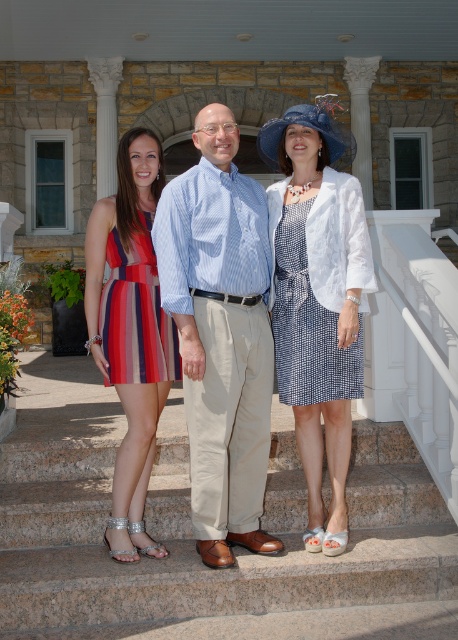
Looking at this image, which of these two, matte blue dress at center or striped fabric dress at center, stands taller?

With more height is matte blue dress at center.

Consider the image. Measure the distance from matte blue dress at center to striped fabric dress at center.

matte blue dress at center and striped fabric dress at center are 6.97 inches apart from each other.

Which is behind, point (190, 326) or point (114, 545)?

The point (114, 545) is more distant.

Image resolution: width=458 pixels, height=640 pixels. In order to click on matte blue dress at center in this screenshot , I will do `click(221, 332)`.

Which is below, blue striped shirt at center or blue textured dress at center?

blue striped shirt at center is lower down.

Is blue striped shirt at center to the left of blue textured dress at center from the viewer's perspective?

Correct, you'll find blue striped shirt at center to the left of blue textured dress at center.

Is point (257, 278) positioned behind point (349, 413)?

No, it is not.

Identify the location of blue striped shirt at center. (221, 333).

Is blue striped shirt at center further to camera compared to blue houndstooth dress at center?

No, blue striped shirt at center is closer to the viewer.

Is blue striped shirt at center in front of blue houndstooth dress at center?

Yes, blue striped shirt at center is closer to the viewer.

Between point (239, 388) and point (327, 396), which one is positioned in front?

Point (239, 388) is more forward.

I want to click on blue striped shirt at center, so (221, 333).